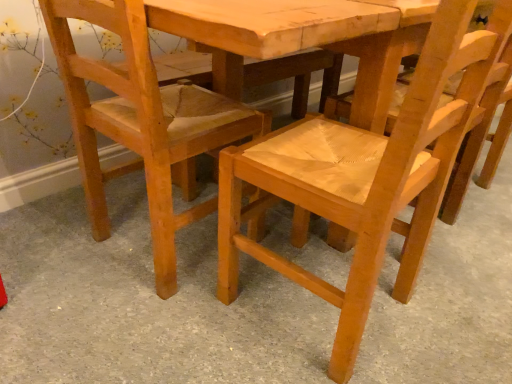
Describe the element at coordinates (142, 122) in the screenshot. I see `light brown wood chair at lower left, which ranks as the 1th chair in left-to-right order` at that location.

What do you see at coordinates (362, 178) in the screenshot?
I see `natural wood chair at center, the first chair from the right` at bounding box center [362, 178].

At what (x,y) coordinates should I click in order to perform the action: click on light brown wood chair at lower left, the second chair positioned from the right. Please return your answer as a coordinate pair (x, y). The height and width of the screenshot is (384, 512). Looking at the image, I should click on (142, 122).

Considering the sizes of objects natural wood chair at center, which appears as the 2th chair when viewed from the left, and natural wood chair at center in the image provided, who is thinner, natural wood chair at center, which appears as the 2th chair when viewed from the left, or natural wood chair at center?

Thinner between the two is natural wood chair at center, which appears as the 2th chair when viewed from the left.

Between natural wood chair at center, which appears as the 2th chair when viewed from the left, and natural wood chair at center, which one appears on the right side from the viewer's perspective?

Positioned to the right is natural wood chair at center.

Is natural wood chair at center, which appears as the 2th chair when viewed from the left, taller than natural wood chair at center?

Indeed, natural wood chair at center, which appears as the 2th chair when viewed from the left, has a greater height compared to natural wood chair at center.

From a real-world perspective, is natural wood chair at center, which appears as the 2th chair when viewed from the left, positioned under natural wood chair at center based on gravity?

Incorrect, from a real-world perspective, natural wood chair at center, which appears as the 2th chair when viewed from the left, is higher than natural wood chair at center.

Find the location of a particular element. The width and height of the screenshot is (512, 384). chair that is the 1st one when counting backward from the natural wood chair at center is located at coordinates (362, 178).

Considering the relative sizes of natural wood chair at center and natural wood chair at center, the first chair from the right, in the image provided, is natural wood chair at center bigger than natural wood chair at center, the first chair from the right,?

Indeed, natural wood chair at center has a larger size compared to natural wood chair at center, the first chair from the right.

From a real-world perspective, is natural wood chair at center physically below natural wood chair at center, which appears as the 2th chair when viewed from the left?

Yes.

From the image's perspective, is light brown wood chair at lower left, which ranks as the 1th chair in left-to-right order, beneath natural wood chair at center, which appears as the 2th chair when viewed from the left?

No, from the image's perspective, light brown wood chair at lower left, which ranks as the 1th chair in left-to-right order, is not below natural wood chair at center, which appears as the 2th chair when viewed from the left.

Is light brown wood chair at lower left, which ranks as the 1th chair in left-to-right order, shorter than natural wood chair at center, the first chair from the right?

Yes.

Is light brown wood chair at lower left, which ranks as the 1th chair in left-to-right order, not within natural wood chair at center, which appears as the 2th chair when viewed from the left?

Yes.

Based on the photo, considering the sizes of light brown wood chair at lower left, which ranks as the 1th chair in left-to-right order, and natural wood chair at center, the first chair from the right, in the image, is light brown wood chair at lower left, which ranks as the 1th chair in left-to-right order, wider or thinner than natural wood chair at center, the first chair from the right,?

In the image, light brown wood chair at lower left, which ranks as the 1th chair in left-to-right order, appears to be wider than natural wood chair at center, the first chair from the right.

What's the angular difference between light brown wood chair at lower left, which ranks as the 1th chair in left-to-right order, and natural wood chair at center's facing directions?

They differ by 0.184 degrees in their facing directions.

Between light brown wood chair at lower left, the second chair positioned from the right, and natural wood chair at center, which one has larger size?

Bigger between the two is natural wood chair at center.

Would you say light brown wood chair at lower left, which ranks as the 1th chair in left-to-right order, is inside or outside natural wood chair at center?

light brown wood chair at lower left, which ranks as the 1th chair in left-to-right order, is not inside natural wood chair at center, it's outside.

Based on their positions, is natural wood chair at center, the first chair from the right, located to the left or right of light brown wood chair at lower left, the second chair positioned from the right?

From the image, it's evident that natural wood chair at center, the first chair from the right, is to the right of light brown wood chair at lower left, the second chair positioned from the right.

Is natural wood chair at center, which appears as the 2th chair when viewed from the left, wider than light brown wood chair at lower left, which ranks as the 1th chair in left-to-right order?

In fact, natural wood chair at center, which appears as the 2th chair when viewed from the left, might be narrower than light brown wood chair at lower left, which ranks as the 1th chair in left-to-right order.

I want to click on chair located above the light brown wood chair at lower left, the second chair positioned from the right (from a real-world perspective), so click(362, 178).

Which is less distant, (452, 290) or (70, 84)?

Point (452, 290) appears to be farther away from the viewer than point (70, 84).

Is natural wood chair at center looking in the opposite direction of light brown wood chair at lower left, which ranks as the 1th chair in left-to-right order?

That's not correct — natural wood chair at center is not looking away from light brown wood chair at lower left, which ranks as the 1th chair in left-to-right order.

Are natural wood chair at center and light brown wood chair at lower left, which ranks as the 1th chair in left-to-right order, making contact?

No.

The height and width of the screenshot is (384, 512). Identify the location of concrete that is on the right side of natural wood chair at center, which appears as the 2th chair when viewed from the left. (145, 304).

Locate an element on the screen. The image size is (512, 384). the 2nd chair located above the natural wood chair at center (from a real-world perspective) is located at coordinates (362, 178).

Looking at the image, which one is located further to natural wood chair at center, which appears as the 2th chair when viewed from the left, light brown wood chair at lower left, the second chair positioned from the right, or natural wood chair at center?

The object further to natural wood chair at center, which appears as the 2th chair when viewed from the left, is natural wood chair at center.

Estimate the real-world distances between objects in this image. Which object is closer to natural wood chair at center, the first chair from the right, natural wood chair at center or light brown wood chair at lower left, which ranks as the 1th chair in left-to-right order?

light brown wood chair at lower left, which ranks as the 1th chair in left-to-right order, lies closer to natural wood chair at center, the first chair from the right, than the other object.

Looking at the image, which one is located closer to natural wood chair at center, natural wood chair at center, the first chair from the right, or light brown wood chair at lower left, the second chair positioned from the right?

natural wood chair at center, the first chair from the right.

From the image, which object appears to be nearer to natural wood chair at center, light brown wood chair at lower left, which ranks as the 1th chair in left-to-right order, or natural wood chair at center, which appears as the 2th chair when viewed from the left?

Answer: natural wood chair at center, which appears as the 2th chair when viewed from the left, is closer to natural wood chair at center.

Considering their positions, is natural wood chair at center positioned closer to light brown wood chair at lower left, which ranks as the 1th chair in left-to-right order, than natural wood chair at center, the first chair from the right?

Among the two, natural wood chair at center, the first chair from the right, is located nearer to light brown wood chair at lower left, which ranks as the 1th chair in left-to-right order.

Looking at the image, which one is located further to light brown wood chair at lower left, the second chair positioned from the right, natural wood chair at center, which appears as the 2th chair when viewed from the left, or natural wood chair at center?

natural wood chair at center.

Locate an element on the screen. chair located between light brown wood chair at lower left, the second chair positioned from the right, and natural wood chair at center in the left-right direction is located at coordinates coord(362,178).